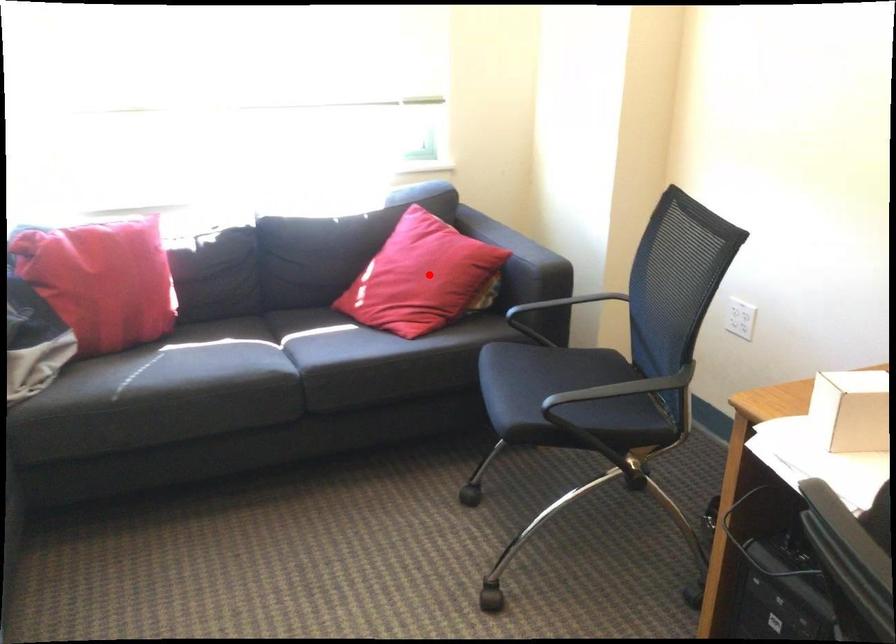
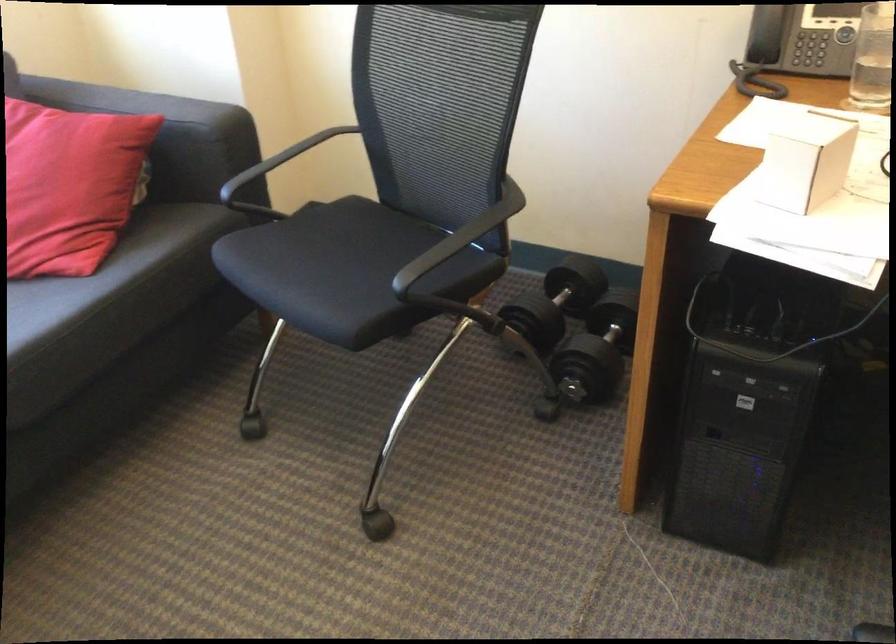
Question: I am providing you with two images of the same scene from different viewpoints. Image1 has a red point marked. In image2, the corresponding 3D location appears at what relative position? Reply with the corresponding letter.

Choices:
 (A) Closer
 (B) Farther

Answer: (A)